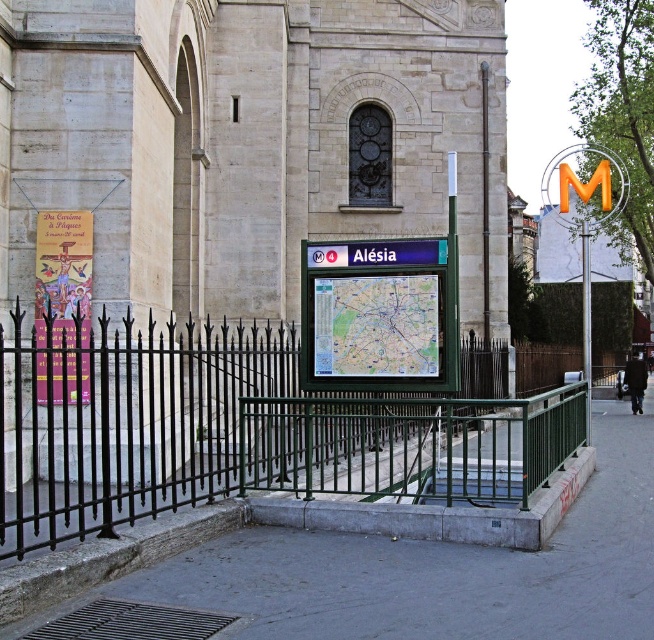
You are a tourist holding a paper map at center and looking at the beige stone church at center. Which object is closer to you?

The beige stone church at center is closer to you than the paper map at center.

You are standing at the Al?sa metro station entrance and want to locate both the beige stone church at center and the gray concrete pavement at center. According to the scene, which one is positioned to the left side from your viewpoint?

The beige stone church at center is positioned to the left of the gray concrete pavement at center, so the beige stone church at center is on the left side.